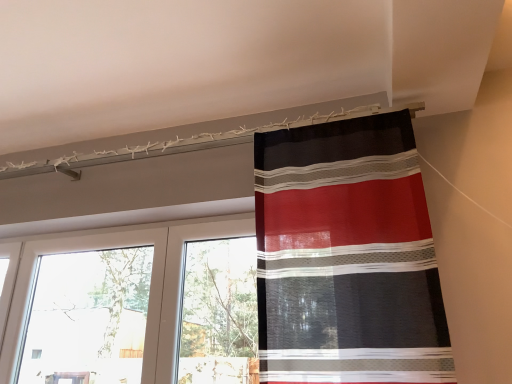
Locate an element on the screen. This screenshot has width=512, height=384. textured fabric curtain at upper right is located at coordinates (347, 257).

In the scene shown: Measure the distance between point (312, 293) and camera.

Point (312, 293) and camera are 4.60 feet apart.

The height and width of the screenshot is (384, 512). Describe the element at coordinates (347, 257) in the screenshot. I see `textured fabric curtain at upper right` at that location.

In order to click on textured fabric curtain at upper right in this screenshot , I will do `click(347, 257)`.